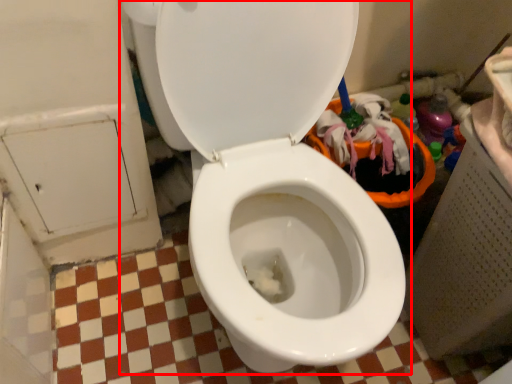
Question: From the image's perspective, what is the correct spatial positioning of toilet (annotated by the red box) in reference to dust?

Choices:
 (A) below
 (B) above

Answer: (B)